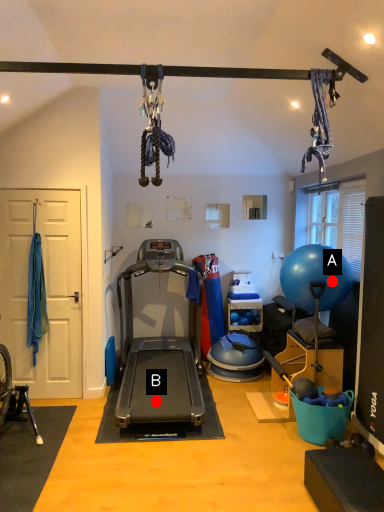
Question: Two points are circled on the image, labeled by A and B beside each circle. Which point appears closest to the camera in this image?

Choices:
 (A) A is closer
 (B) B is closer

Answer: (B)